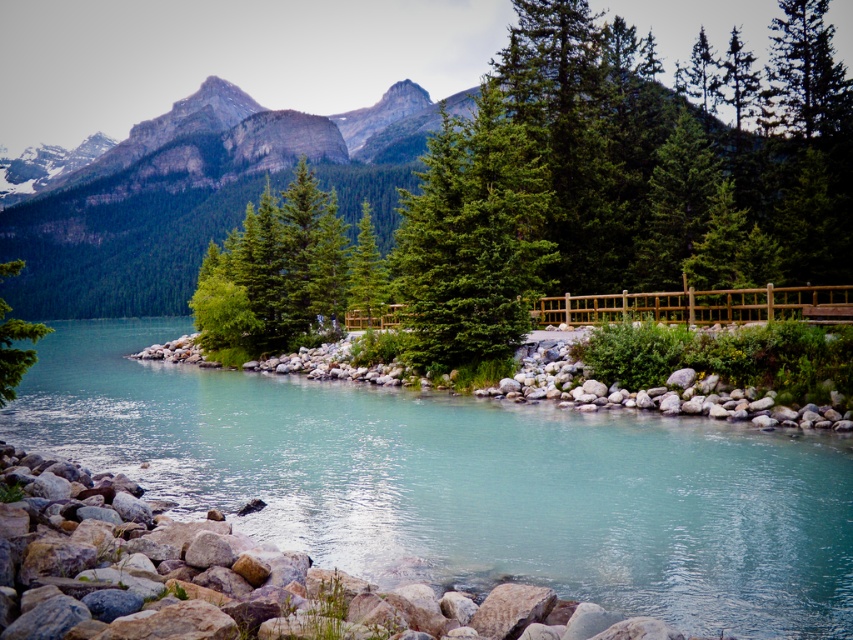
Question: Does clear water at center have a smaller size compared to green matte tree at left?

Choices:
 (A) no
 (B) yes

Answer: (B)

Question: Which point is farther to the camera?

Choices:
 (A) (4, 346)
 (B) (430, 483)

Answer: (B)

Question: Considering the relative positions of clear water at center and green matte tree at left in the image provided, where is clear water at center located with respect to green matte tree at left?

Choices:
 (A) below
 (B) above

Answer: (A)

Question: Which object appears farthest from the camera in this image?

Choices:
 (A) green matte tree at left
 (B) clear water at center

Answer: (A)

Question: From the image, what is the correct spatial relationship of clear water at center in relation to green matte tree at left?

Choices:
 (A) above
 (B) below

Answer: (B)